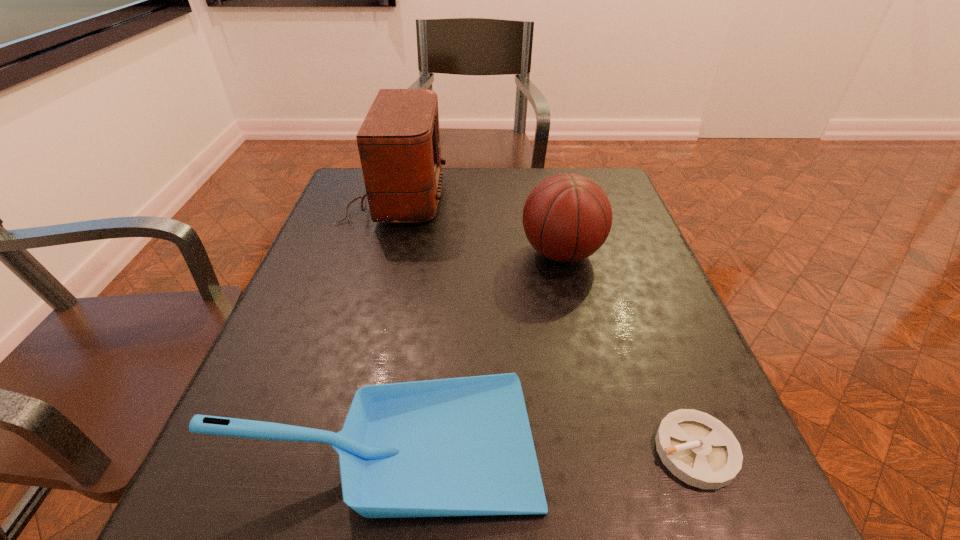
This screenshot has width=960, height=540. I want to click on object that is positioned at the far edge, so click(x=399, y=146).

Locate an element on the screen. The image size is (960, 540). dustpan at the near edge is located at coordinates (463, 446).

Locate an element on the screen. This screenshot has width=960, height=540. ashtray that is at the near edge is located at coordinates (697, 448).

In order to click on radio receiver that is at the left edge in this screenshot , I will do `click(399, 146)`.

Identify the location of dustpan at the left edge. (463, 446).

In order to click on basketball that is at the right edge in this screenshot , I will do `click(567, 217)`.

Locate an element on the screen. ashtray situated at the right edge is located at coordinates [697, 448].

The image size is (960, 540). I want to click on object at the far left corner, so click(399, 146).

The image size is (960, 540). Find the location of `object at the near left corner`. object at the near left corner is located at coordinates (463, 446).

This screenshot has height=540, width=960. In order to click on object that is at the near right corner in this screenshot , I will do `click(697, 448)`.